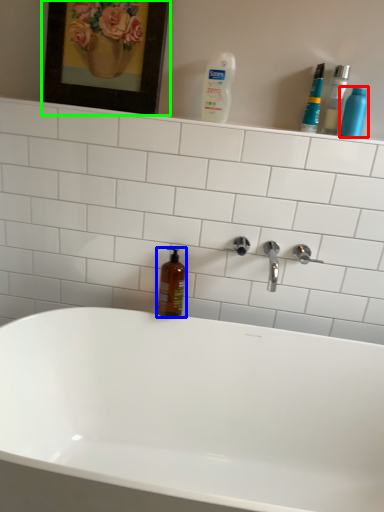
Question: Which object is the farthest from cleaning product (highlighted by a red box)? Choose among these: mouthwash (highlighted by a blue box) or picture frame (highlighted by a green box).

Choices:
 (A) mouthwash
 (B) picture frame

Answer: (A)